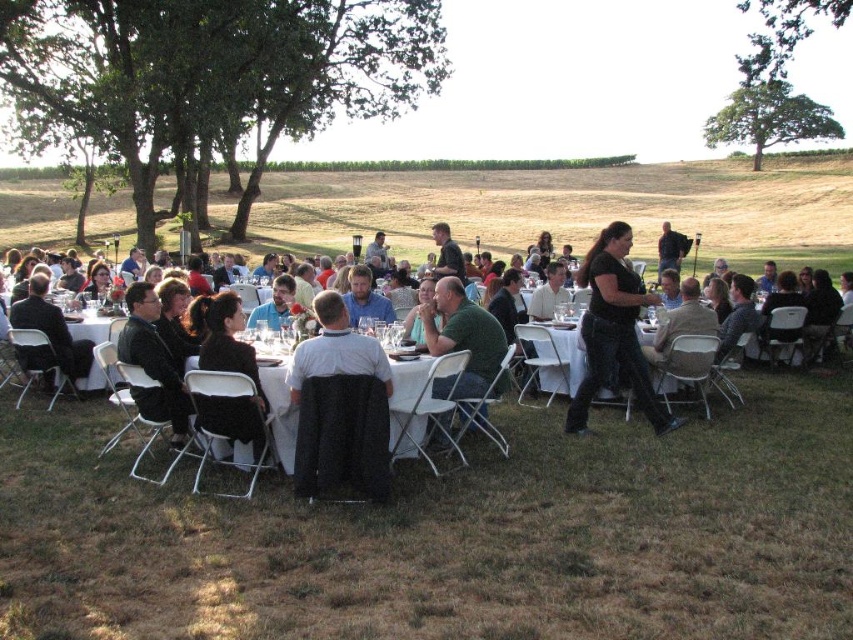
Which is below, black fabric dress at center or black fabric table at center?

black fabric table at center is lower down.

Which is behind, point (804, 426) or point (291, 467)?

Point (804, 426)

I want to click on black fabric dress at center, so click(280, 412).

In order to click on black fabric jacket at lower left in this screenshot , I will do `click(227, 371)`.

Is point (225, 429) farther from camera compared to point (351, 371)?

Yes, it is behind point (351, 371).

This screenshot has width=853, height=640. I want to click on black fabric jacket at lower left, so click(x=227, y=371).

Between point (694, 440) and point (567, 340), which one is positioned in front?

Positioned in front is point (694, 440).

Can you confirm if black fabric dress at center is bigger than white glossy table at center?

Correct, black fabric dress at center is larger in size than white glossy table at center.

Identify the location of black fabric dress at center. Image resolution: width=853 pixels, height=640 pixels. (280, 412).

Locate an element on the screen. The image size is (853, 640). black fabric dress at center is located at coordinates (280, 412).